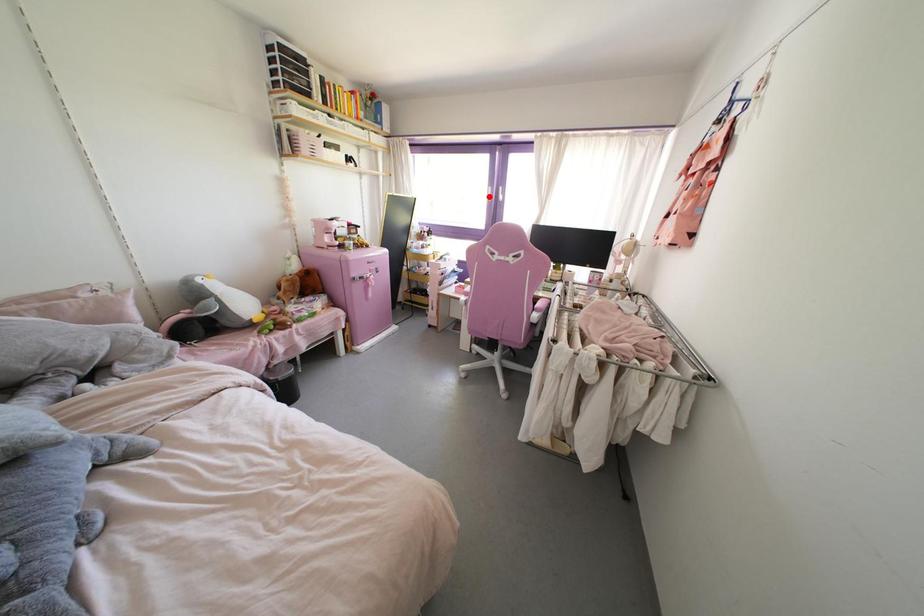
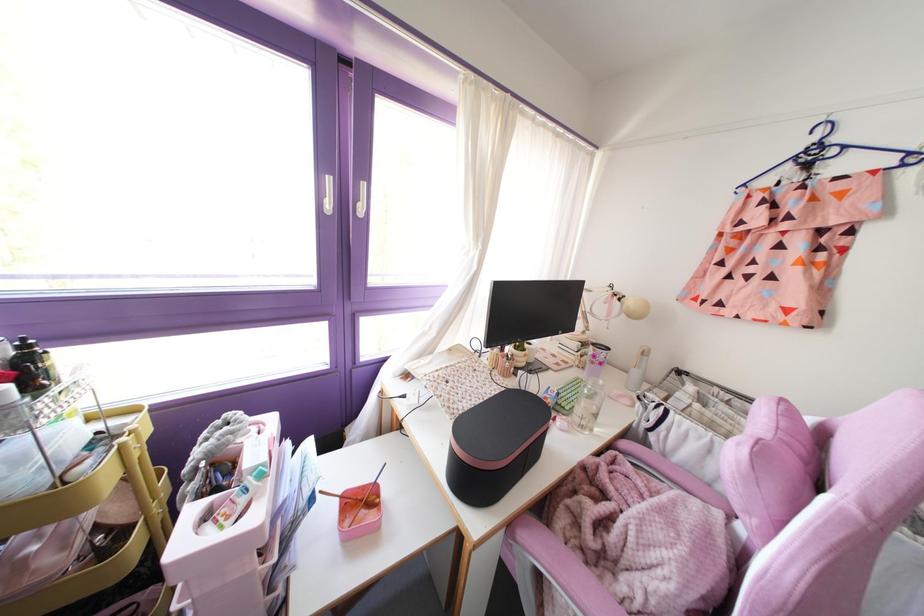
Question: A red point is marked in image1. In image2, is the corresponding 3D point closer to the camera or farther? Reply with the corresponding letter.

Choices:
 (A) The corresponding 3D point is closer.
 (B) The corresponding 3D point is farther.

Answer: (B)